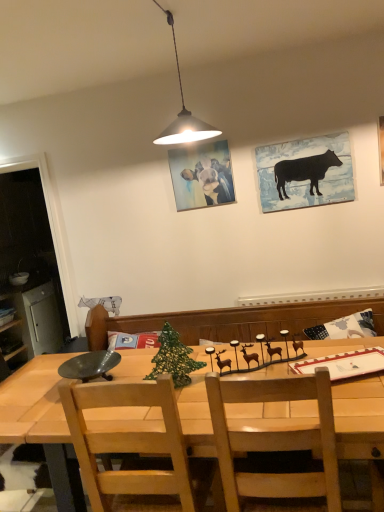
Question: Are brushed metal cabinet at left and light brown wooden chair at center beside each other?

Choices:
 (A) no
 (B) yes

Answer: (A)

Question: Is brushed metal cabinet at left not close to light brown wooden chair at center?

Choices:
 (A) yes
 (B) no

Answer: (A)

Question: Is brushed metal cabinet at left wider than light brown wooden chair at center?

Choices:
 (A) no
 (B) yes

Answer: (B)

Question: From the image's perspective, is brushed metal cabinet at left on top of light brown wooden chair at center?

Choices:
 (A) yes
 (B) no

Answer: (A)

Question: Can light brown wooden chair at center be found inside brushed metal cabinet at left?

Choices:
 (A) no
 (B) yes

Answer: (A)

Question: Is brushed metal cabinet at left not inside light brown wooden chair at center?

Choices:
 (A) yes
 (B) no

Answer: (A)

Question: Can you confirm if light brown wooden chair at center is wider than green mesh christmas tree at center?

Choices:
 (A) no
 (B) yes

Answer: (B)

Question: Is light brown wooden chair at center at the right side of green mesh christmas tree at center?

Choices:
 (A) yes
 (B) no

Answer: (B)

Question: Can you confirm if light brown wooden chair at center is positioned to the left of green mesh christmas tree at center?

Choices:
 (A) no
 (B) yes

Answer: (B)

Question: Does light brown wooden chair at center have a greater height compared to green mesh christmas tree at center?

Choices:
 (A) yes
 (B) no

Answer: (A)

Question: Considering the relative positions of light brown wooden chair at center and green mesh christmas tree at center in the image provided, is light brown wooden chair at center behind green mesh christmas tree at center?

Choices:
 (A) no
 (B) yes

Answer: (A)

Question: Considering the relative sizes of light brown wooden chair at center and green mesh christmas tree at center in the image provided, is light brown wooden chair at center thinner than green mesh christmas tree at center?

Choices:
 (A) no
 (B) yes

Answer: (A)

Question: Is wooden table at center not inside light brown wooden chair at center?

Choices:
 (A) yes
 (B) no

Answer: (A)